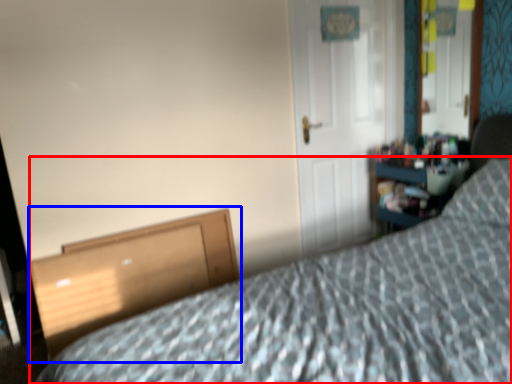
Question: Which object appears closest to the camera in this image, bed (highlighted by a red box) or file cabinet (highlighted by a blue box)?

Choices:
 (A) bed
 (B) file cabinet

Answer: (A)